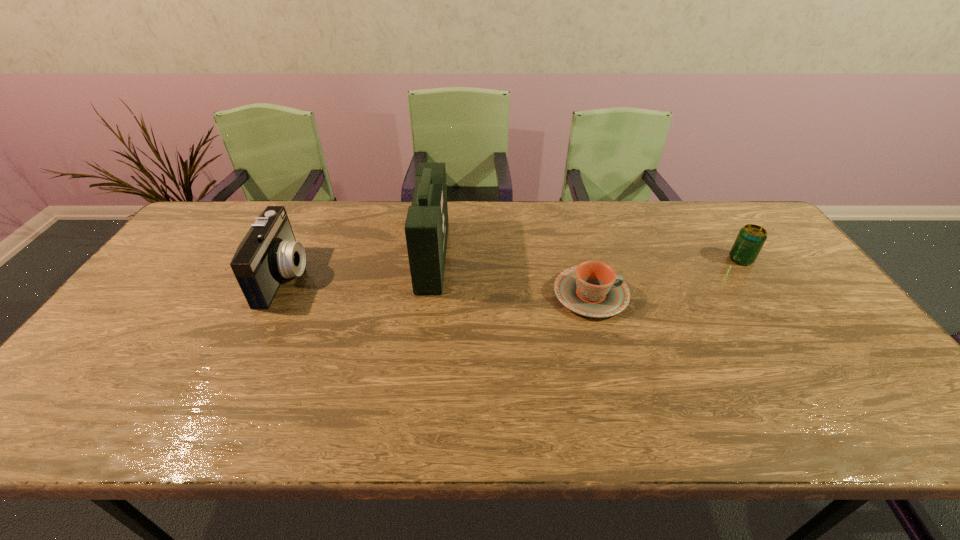
Where is `vacant area in the image that satisfies the following two spatial constraints: 1. on the front-facing side of the first-aid kit; 2. on the left side of the second shortest object`? The image size is (960, 540). vacant area in the image that satisfies the following two spatial constraints: 1. on the front-facing side of the first-aid kit; 2. on the left side of the second shortest object is located at coordinates (432, 259).